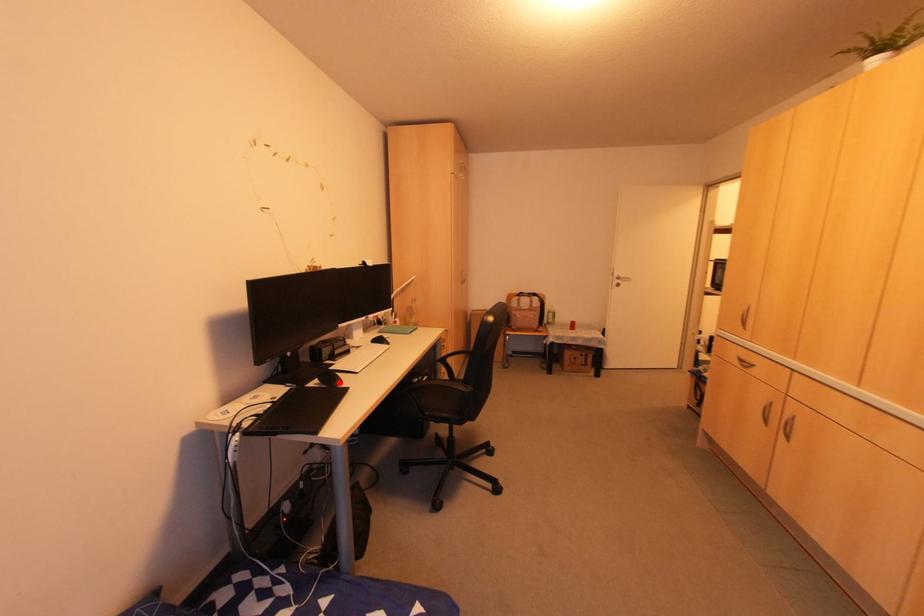
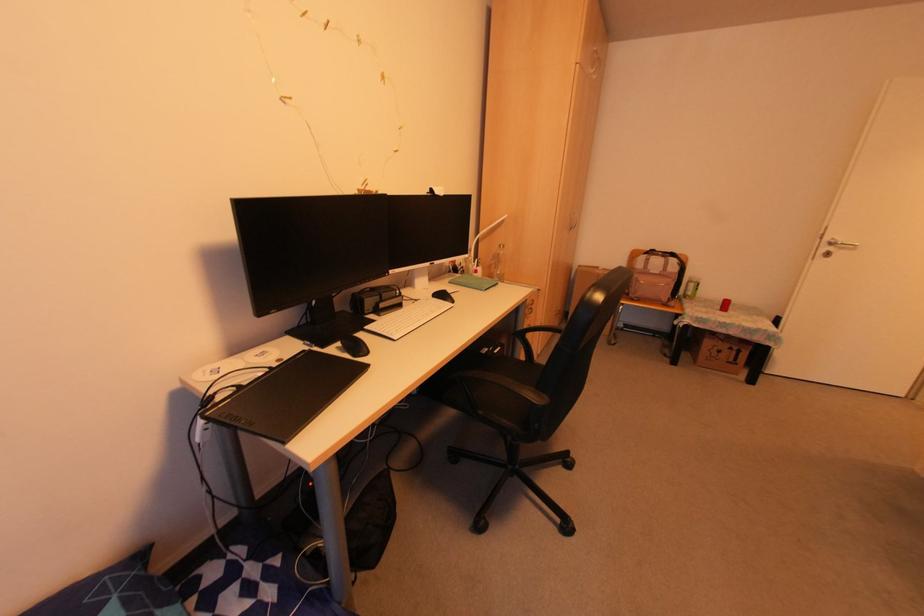
The point at the highlighted location is marked in the first image. Where is the corresponding point in the second image?

(365, 353)